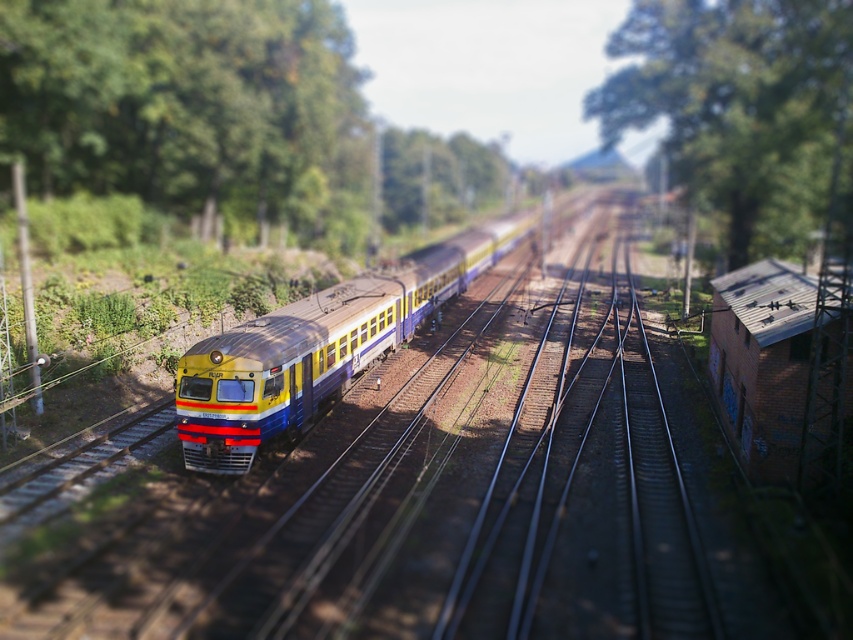
Who is taller, green leafy tree at upper left or yellow matte train at center?

With more height is green leafy tree at upper left.

Measure the distance between green leafy tree at upper left and camera.

A distance of 48.02 meters exists between green leafy tree at upper left and camera.

Where is `green leafy tree at upper left`? green leafy tree at upper left is located at coordinates (190, 108).

I want to click on green leafy tree at upper left, so click(x=190, y=108).

Does green leafy tree at upper center have a smaller size compared to yellow matte train at center?

No, green leafy tree at upper center is not smaller than yellow matte train at center.

Based on the photo, who is positioned more to the right, green leafy tree at upper center or yellow matte train at center?

From the viewer's perspective, green leafy tree at upper center appears more on the right side.

Locate an element on the screen. Image resolution: width=853 pixels, height=640 pixels. green leafy tree at upper center is located at coordinates (743, 109).

At what (x,y) coordinates should I click in order to perform the action: click on green leafy tree at upper center. Please return your answer as a coordinate pair (x, y). This screenshot has height=640, width=853. Looking at the image, I should click on (743, 109).

Is the position of green leafy tree at upper left more distant than that of green leafy tree at upper center?

That is True.

Can you confirm if green leafy tree at upper left is shorter than green leafy tree at upper center?

Yes.

Looking at this image, who is more distant from viewer, [233,104] or [664,51]?

The point [664,51] is more distant.

At what (x,y) coordinates should I click in order to perform the action: click on green leafy tree at upper left. Please return your answer as a coordinate pair (x, y). Looking at the image, I should click on (190, 108).